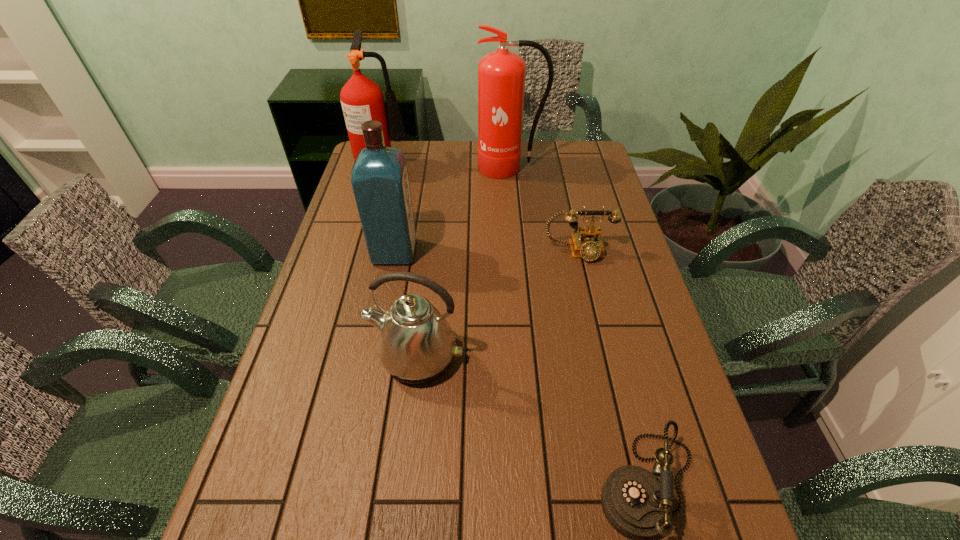
Locate an element on the screen. vacant space located on the dial number of the farther telephone is located at coordinates (604, 363).

Identify the location of fire extinguisher present at the left edge. (362, 100).

Locate an element on the screen. liquor located at the left edge is located at coordinates (379, 178).

I want to click on object positioned at the right edge, so click(x=587, y=243).

Identify the location of object present at the far left corner. Image resolution: width=960 pixels, height=540 pixels. (362, 100).

Find the location of a particular element. The height and width of the screenshot is (540, 960). vacant area at the left edge of the desktop is located at coordinates (319, 289).

In the image, there is a desktop. At what (x,y) coordinates should I click in order to perform the action: click on free space at the right edge. Please return your answer as a coordinate pair (x, y). The height and width of the screenshot is (540, 960). Looking at the image, I should click on click(x=720, y=501).

Image resolution: width=960 pixels, height=540 pixels. Identify the location of free space at the far right corner. (559, 152).

Find the location of `free space that is in between the liquor and the farther telephone`. free space that is in between the liquor and the farther telephone is located at coordinates (487, 252).

Identify the location of vacant space that's between the liquor and the farther telephone. The image size is (960, 540). (487, 252).